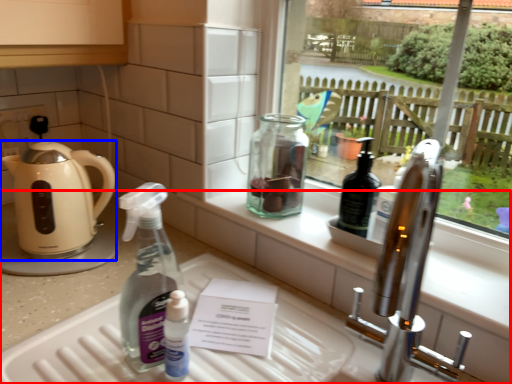
Question: Which object appears closest to the camera in this image, counter (highlighted by a red box) or kettle (highlighted by a blue box)?

Choices:
 (A) counter
 (B) kettle

Answer: (A)